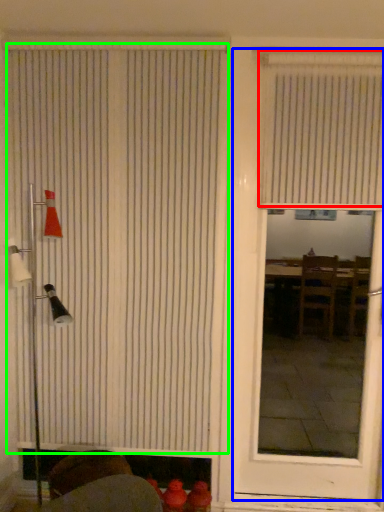
Question: Estimate the real-world distances between objects in this image. Which object is farther from window blind (highlighted by a red box), door (highlighted by a blue box) or window blind (highlighted by a green box)?

Choices:
 (A) door
 (B) window blind

Answer: (B)